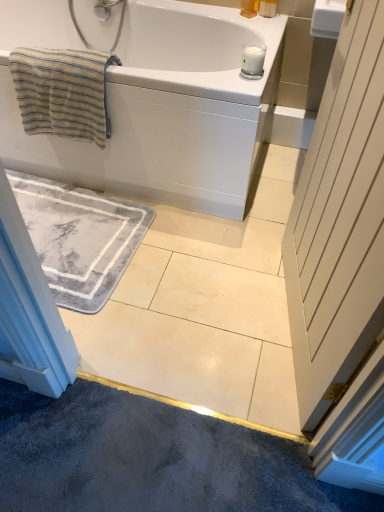
You are a GUI agent. You are given a task and a screenshot of the screen. Output one action in this format:
    pyautogui.click(x=<x>, y=<y>)
    Task: Click on the vacant space that is to the left of white wooden door at right
    The width and height of the screenshot is (384, 512).
    Given the screenshot: What is the action you would take?
    pyautogui.click(x=200, y=313)